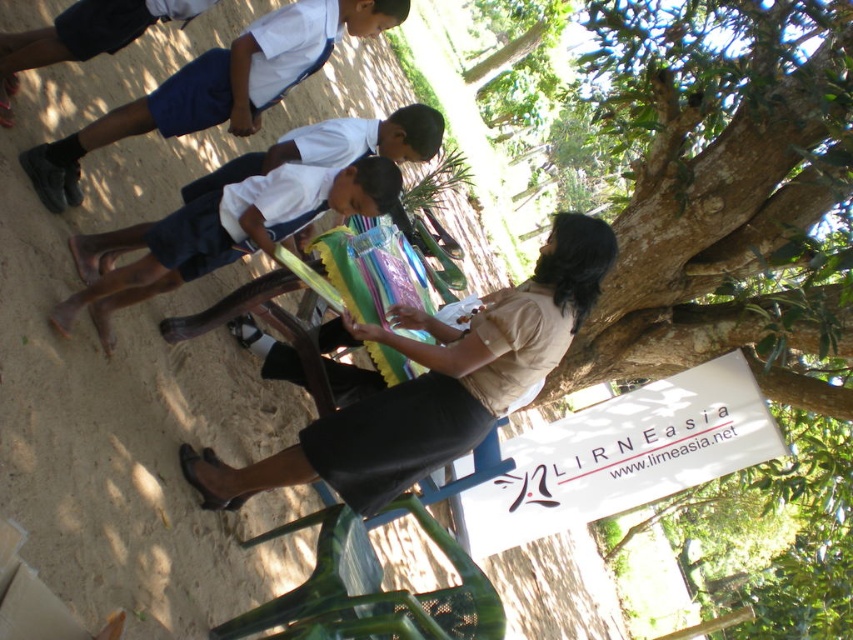
Does white shirt at center appear under white uniform shirt at upper left?

Correct, white shirt at center is located below white uniform shirt at upper left.

Measure the distance between point (358, 512) and camera.

Point (358, 512) and camera are 3.98 meters apart.

Is point (378, 442) behind point (91, 150)?

No.

You are a GUI agent. You are given a task and a screenshot of the screen. Output one action in this format:
    pyautogui.click(x=<x>, y=<y>)
    Task: Click on the white shirt at center
    The image size is (853, 640).
    Given the screenshot: What is the action you would take?
    (x=430, y=384)

You are a GUI agent. You are given a task and a screenshot of the screen. Output one action in this format:
    pyautogui.click(x=<x>, y=<y>)
    Task: Click on the green rough bark tree at upper right
    The height and width of the screenshot is (640, 853).
    Given the screenshot: What is the action you would take?
    pyautogui.click(x=724, y=193)

Which is more to the left, green rough bark tree at upper right or white fabric shirt at upper left?

white fabric shirt at upper left

Is green rough bark tree at upper right smaller than white fabric shirt at upper left?

Yes, green rough bark tree at upper right is smaller than white fabric shirt at upper left.

Does point (846, 497) come farther from viewer compared to point (280, 90)?

That is True.

At what (x,y) coordinates should I click in order to perform the action: click on green rough bark tree at upper right. Please return your answer as a coordinate pair (x, y). The height and width of the screenshot is (640, 853). Looking at the image, I should click on (724, 193).